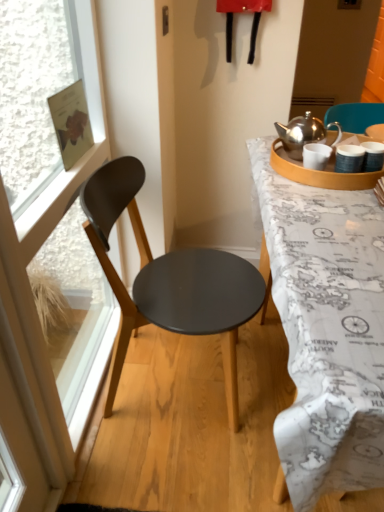
Question: Could you tell me if matte black chair at left is facing transparent glass window at left?

Choices:
 (A) no
 (B) yes

Answer: (A)

Question: Is matte black chair at left not close to transparent glass window at left?

Choices:
 (A) no
 (B) yes

Answer: (A)

Question: Does matte black chair at left have a lesser width compared to transparent glass window at left?

Choices:
 (A) yes
 (B) no

Answer: (B)

Question: Can you confirm if matte black chair at left is bigger than transparent glass window at left?

Choices:
 (A) yes
 (B) no

Answer: (A)

Question: Considering the relative sizes of matte black chair at left and transparent glass window at left in the image provided, is matte black chair at left smaller than transparent glass window at left?

Choices:
 (A) yes
 (B) no

Answer: (B)

Question: Considering the relative positions of matte black chair at left and transparent glass window at left in the image provided, is matte black chair at left to the right of transparent glass window at left from the viewer's perspective?

Choices:
 (A) yes
 (B) no

Answer: (A)

Question: From the image's perspective, is matte black chair at left located beneath white matte coffee cup at upper right?

Choices:
 (A) yes
 (B) no

Answer: (A)

Question: From the image's perspective, is matte black chair at left over white matte coffee cup at upper right?

Choices:
 (A) no
 (B) yes

Answer: (A)

Question: Can you confirm if matte black chair at left is smaller than white matte coffee cup at upper right?

Choices:
 (A) yes
 (B) no

Answer: (B)

Question: Is matte black chair at left not within white matte coffee cup at upper right?

Choices:
 (A) yes
 (B) no

Answer: (A)

Question: Is matte black chair at left touching white matte coffee cup at upper right?

Choices:
 (A) no
 (B) yes

Answer: (A)

Question: Considering the relative positions of matte black chair at left and white matte coffee cup at upper right in the image provided, is matte black chair at left behind white matte coffee cup at upper right?

Choices:
 (A) no
 (B) yes

Answer: (A)

Question: Is white matte coffee cup at upper right bigger than white map-covered desk at right?

Choices:
 (A) no
 (B) yes

Answer: (A)